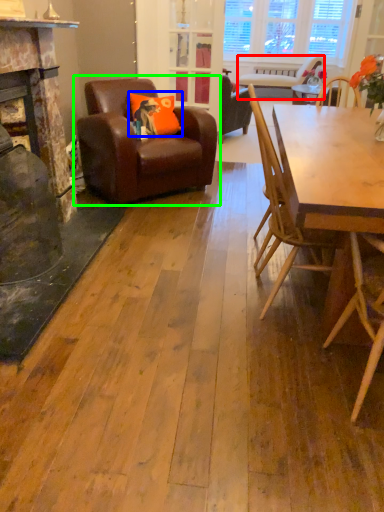
Question: Which object is positioned closest to chair (highlighted by a red box)? Select from pillow (highlighted by a blue box) and chair (highlighted by a green box).

Choices:
 (A) pillow
 (B) chair

Answer: (A)